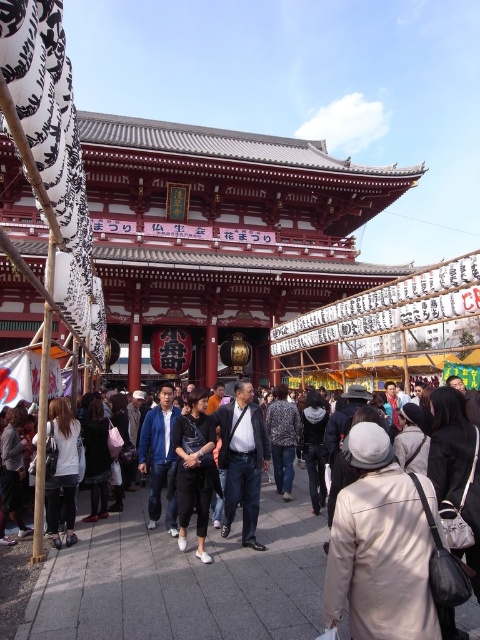
Between point (21, 518) and point (276, 490), which one is positioned behind?

The point (276, 490) is more distant.

Which is more to the right, denim jacket at lower left or patterned fabric coat at center?

patterned fabric coat at center is more to the right.

Is point (19, 524) behind point (284, 397)?

No, (19, 524) is in front of (284, 397).

I want to click on denim jacket at lower left, so click(12, 472).

Does patterned fabric coat at center lie behind dark gray fabric backpack at center?

That is True.

Image resolution: width=480 pixels, height=640 pixels. What are the coordinates of `patterned fabric coat at center` in the screenshot? It's located at (283, 440).

Which is above, beige fabric coat at center or dark gray fabric backpack at center?

beige fabric coat at center is higher up.

From the picture: Between beige fabric coat at center and dark gray fabric backpack at center, which one has more height?

Standing taller between the two is beige fabric coat at center.

Is point (360, 477) closer to camera compared to point (312, 408)?

Yes, it is.

Find the location of a particular element. The height and width of the screenshot is (640, 480). beige fabric coat at center is located at coordinates (379, 547).